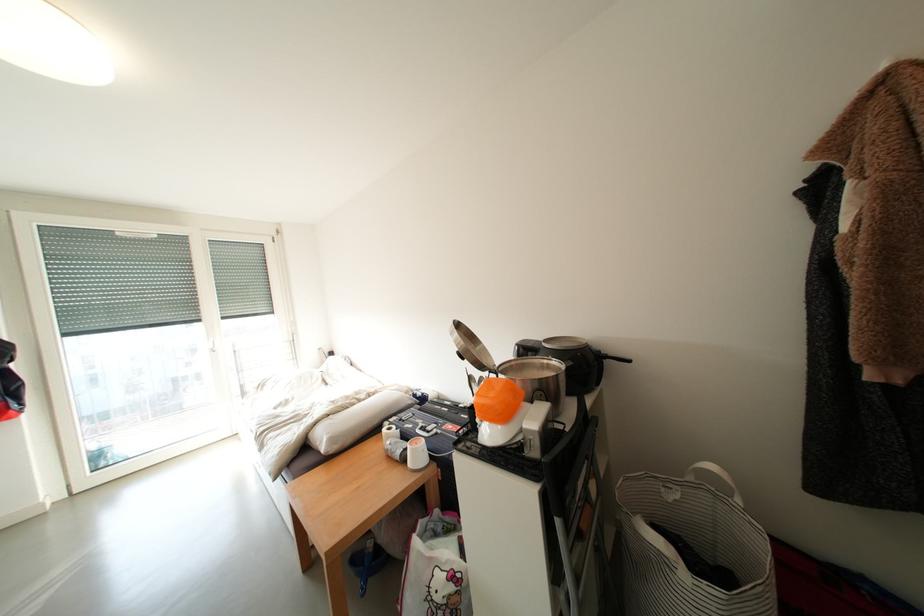
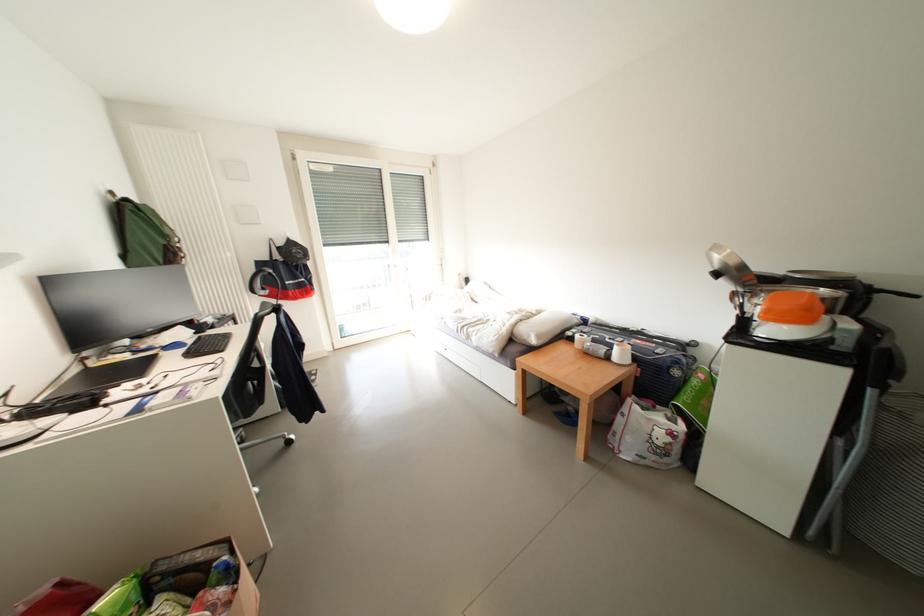
Based on the photo, in a continuous first-person perspective shot, in which direction is the camera moving?

The cameraman moved toward left, backward.